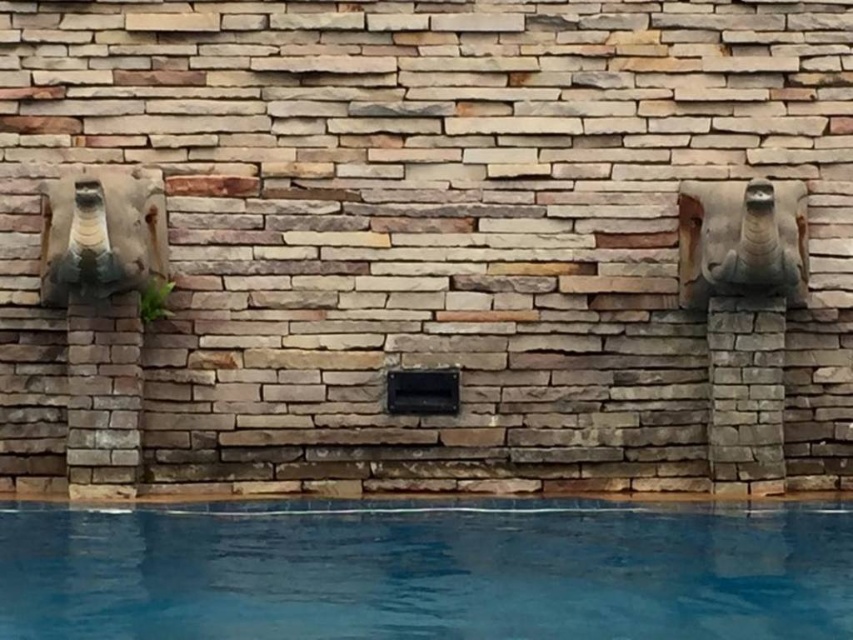
You are standing in front of the poolside wall with two sculpted stone figures. There are two points marked on the wall at coordinates point (363, 588) and point (59, 260). Which point is closer to your eyes?

Point (363, 588) is closer to the camera than point (59, 260).

You are standing at the point marked as point (370,588). The two large sculpted stone figures are on either side of the poolside wall. How far apart are the two figures?

The two large sculpted stone figures are 5.69 meters apart.

You are standing at the center of the poolside wall. There is a bronze statue at left and a point marked at point [102,234]. Which direction should you face to look towards the bronze statue at left?

The point [102,234] indicates the bronze statue at left, so you should face towards the left direction to look towards the bronze statue at left.